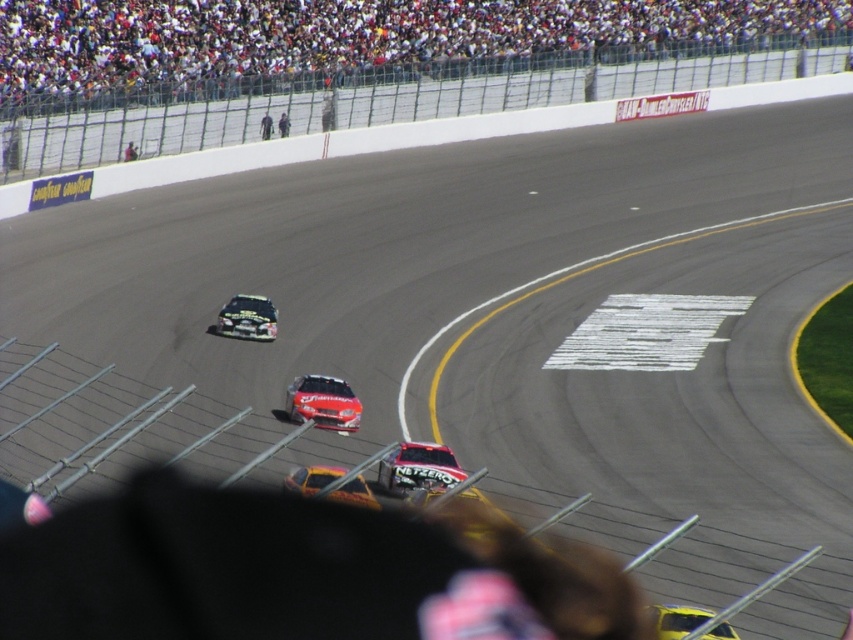
Question: Can you confirm if shiny red car at center is positioned below shiny silver racecar at center?

Choices:
 (A) yes
 (B) no

Answer: (A)

Question: Does shiny silver racecar at center appear over yellow matte car at lower right?

Choices:
 (A) no
 (B) yes

Answer: (B)

Question: Among these objects, which one is farthest from the camera?

Choices:
 (A) dark blue jacket at center
 (B) dark blue shirt at upper center
 (C) shiny silver racecar at center

Answer: (A)

Question: Can you confirm if yellow matte car at lower right is positioned below dark blue jacket at center?

Choices:
 (A) yes
 (B) no

Answer: (A)

Question: Considering the real-world distances, which object is farthest from the shiny silver racecar at center?

Choices:
 (A) dark blue shirt at upper center
 (B) dark blue suit at upper center
 (C) yellow metallic car at center

Answer: (B)

Question: Which object appears closest to the camera in this image?

Choices:
 (A) dark blue jacket at center
 (B) yellow matte car at lower right
 (C) shiny silver racecar at center
 (D) white fabric person at center

Answer: (B)